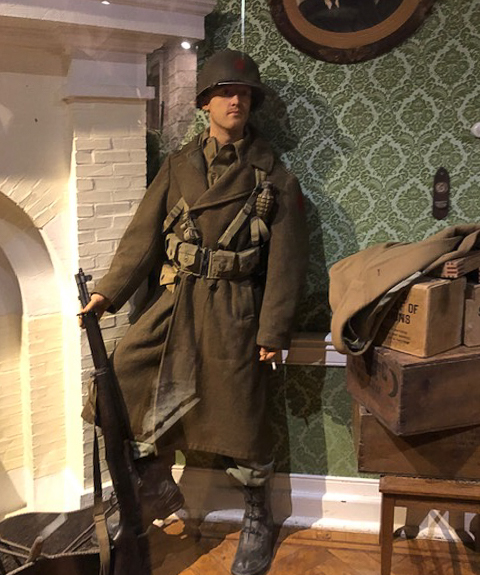
Locate an element on the screen. The width and height of the screenshot is (480, 575). table is located at coordinates (406, 493).